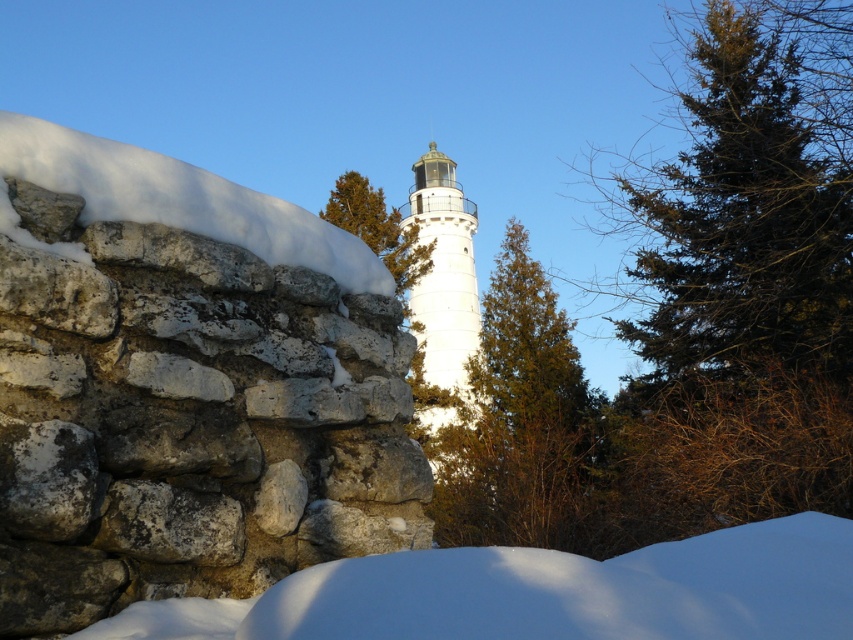
Which is more to the right, green needle-like tree at upper right or white fluffy snow at lower center?

From the viewer's perspective, green needle-like tree at upper right appears more on the right side.

Is green needle-like tree at upper right bigger than white fluffy snow at lower center?

Yes.

Does point (780, 248) come in front of point (805, 520)?

No, it is not.

Find the location of a particular element. green needle-like tree at upper right is located at coordinates (737, 300).

Is white fluffy snow at lower center to the left of white smooth tower at center from the viewer's perspective?

Incorrect, white fluffy snow at lower center is not on the left side of white smooth tower at center.

Who is lower down, white fluffy snow at lower center or white smooth tower at center?

white fluffy snow at lower center

Is point (819, 595) behind point (459, 305)?

No, it is not.

I want to click on white fluffy snow at lower center, so click(544, 593).

Between point (540, 461) and point (213, 202), which one is positioned behind?

Positioned behind is point (540, 461).

Can you confirm if green textured tree at center is positioned to the right of white powdery snow at left?

Indeed, green textured tree at center is positioned on the right side of white powdery snow at left.

Is point (550, 380) farther from camera compared to point (254, 189)?

Yes, point (550, 380) is farther from viewer.

Where is `green textured tree at center`? The height and width of the screenshot is (640, 853). green textured tree at center is located at coordinates (520, 422).